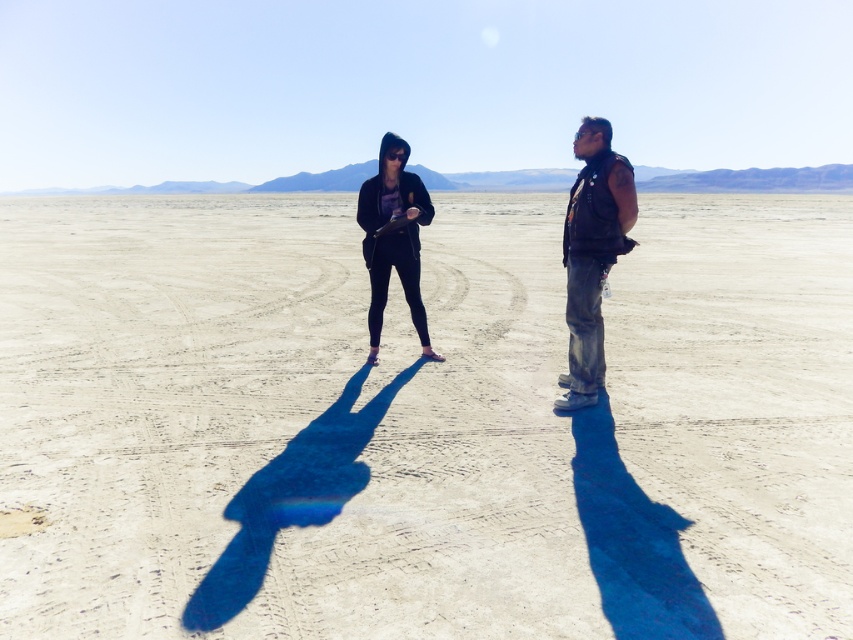
You are planning to place a small flag on the smooth sand at center. Considering the matte black hoodie at center is already there, will the flag fit without overlapping it?

The smooth sand at center might be wider than matte black hoodie at center, so there is a possibility that the flag can be placed without overlapping, but it depends on the exact width difference.

You are a hiker trying to decide where to set up your tent. You have two options in the image provided. One is on the smooth sand at center, and the other is near the black leather vest at right. Which location would be more stable for your tent based on the terrain height?

The smooth sand at center has a greater height compared to the black leather vest at right, so setting up the tent on the smooth sand at center would be more stable due to its higher elevation.